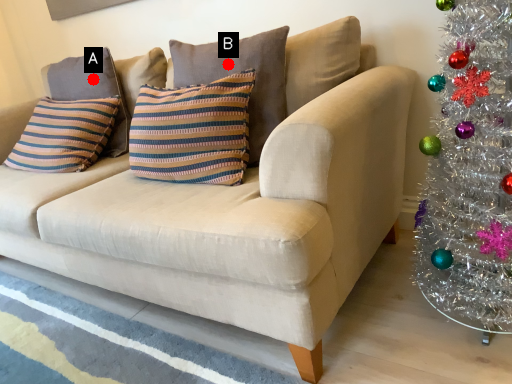
Question: Two points are circled on the image, labeled by A and B beside each circle. Which point appears closest to the camera in this image?

Choices:
 (A) A is closer
 (B) B is closer

Answer: (B)